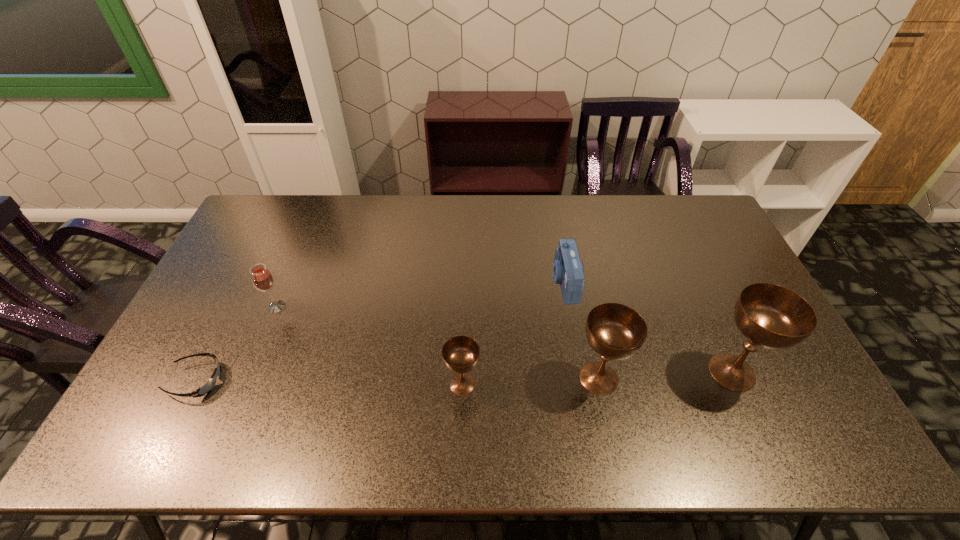
Where is `the fourth object from right to left`? the fourth object from right to left is located at coordinates click(460, 354).

The image size is (960, 540). What are the coordinates of `the leftmost chalice` in the screenshot? It's located at (460, 354).

Where is `the second tallest chalice`? This screenshot has width=960, height=540. the second tallest chalice is located at coordinates pos(615,331).

Where is `the second tallest object`? This screenshot has height=540, width=960. the second tallest object is located at coordinates (615, 331).

Identify the location of the rightmost object. (771, 316).

This screenshot has height=540, width=960. I want to click on the second object from left to right, so click(262, 278).

Where is `the fifth tallest object`? the fifth tallest object is located at coordinates (568, 270).

This screenshot has width=960, height=540. I want to click on the leftmost object, so click(x=207, y=387).

This screenshot has width=960, height=540. Find the location of `the shortest object`. the shortest object is located at coordinates (207, 387).

Image resolution: width=960 pixels, height=540 pixels. Identify the location of free region located 0.290m on the back of the leftmost chalice. (466, 289).